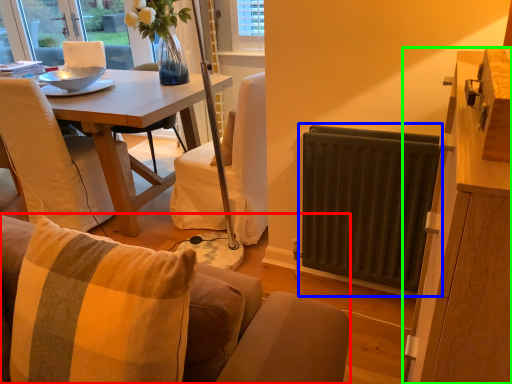
Question: Considering the real-world distances, which object is farthest from studio couch (highlighted by a red box)? radiator (highlighted by a blue box) or cabinetry (highlighted by a green box)?

Choices:
 (A) radiator
 (B) cabinetry

Answer: (A)